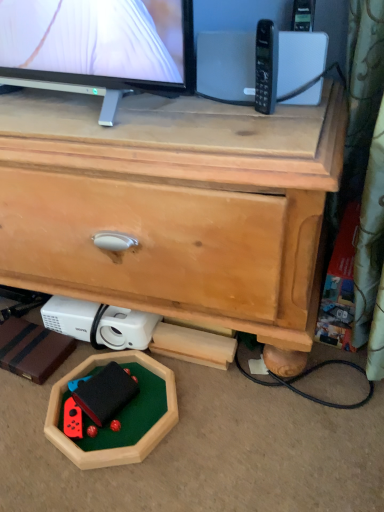
Identify the location of vacant area that is in front of rubberized black toy at lower center. The width and height of the screenshot is (384, 512). (95, 452).